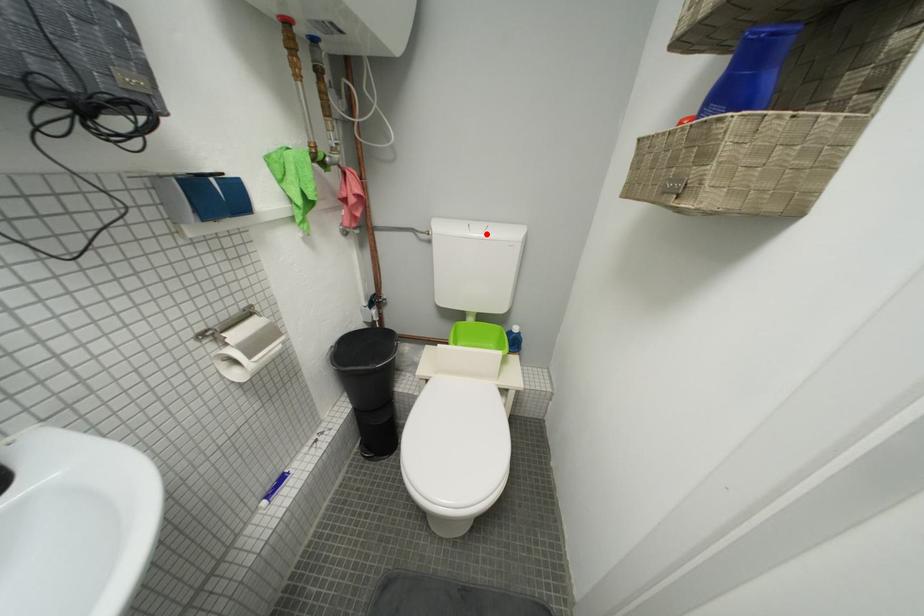
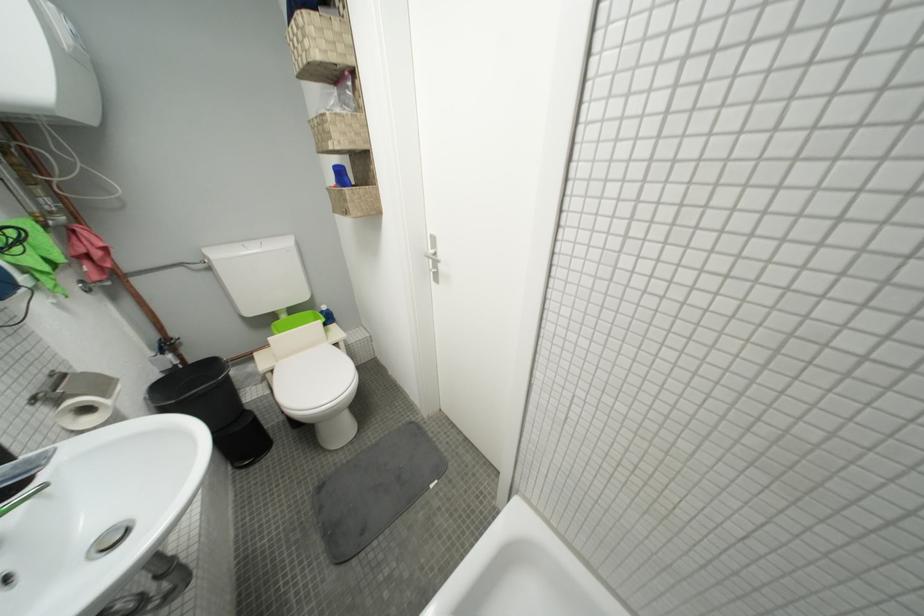
The point at the highlighted location is marked in the first image. Where is the corresponding point in the second image?

(262, 252)